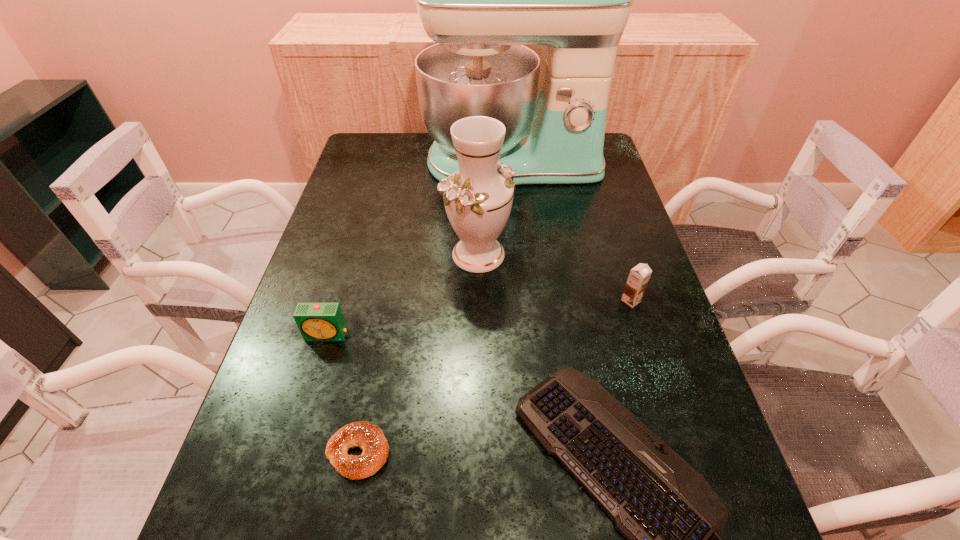
I want to click on blank space located 0.290m on the front of the vase, so coord(477,385).

The height and width of the screenshot is (540, 960). I want to click on free region located on the left of the chocolate milk, so tap(468, 300).

This screenshot has width=960, height=540. What are the coordinates of `vacant point located on the front-facing side of the fourth tallest object` in the screenshot? It's located at (x=285, y=475).

Locate an element on the screen. This screenshot has width=960, height=540. vacant space located 0.050m on the front of the bagel is located at coordinates (347, 514).

At what (x,y) coordinates should I click in order to perform the action: click on object that is at the far edge. Please return your answer as a coordinate pair (x, y). This screenshot has height=540, width=960. Looking at the image, I should click on (481, 0).

Image resolution: width=960 pixels, height=540 pixels. I want to click on alarm clock that is at the left edge, so click(x=316, y=321).

What are the coordinates of `bagel positioned at the left edge` in the screenshot? It's located at (367, 436).

You are a GUI agent. You are given a task and a screenshot of the screen. Output one action in this format:
    pyautogui.click(x=<x>, y=<y>)
    Task: Click on the mixer present at the right edge
    Image resolution: width=960 pixels, height=540 pixels.
    Given the screenshot: What is the action you would take?
    pyautogui.click(x=481, y=0)

Where is `chocolate milk at the right edge`? chocolate milk at the right edge is located at coordinates (639, 276).

You are a GUI agent. You are given a task and a screenshot of the screen. Output one action in this format:
    pyautogui.click(x=<x>, y=<y>)
    Task: Click on the object present at the far right corner
    
    Given the screenshot: What is the action you would take?
    click(481, 0)